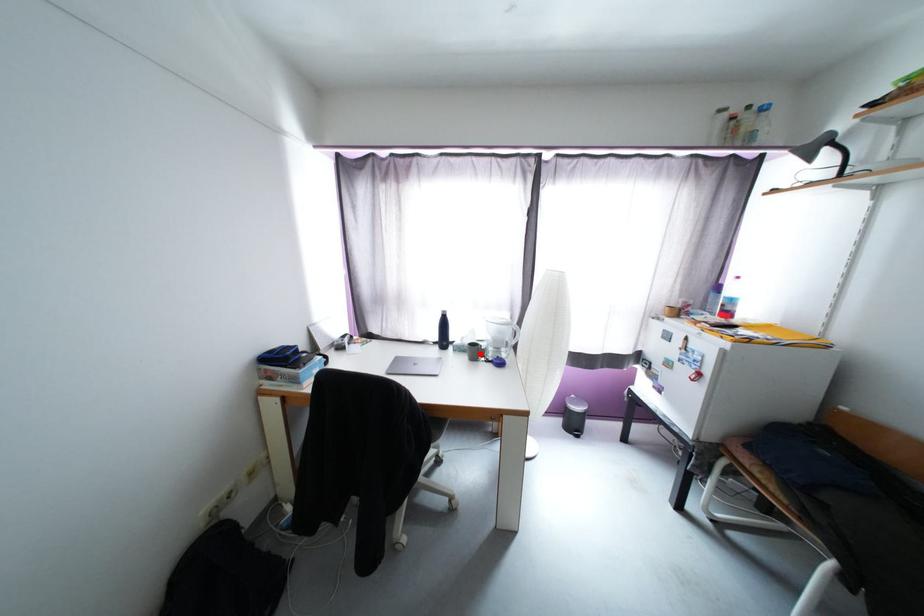
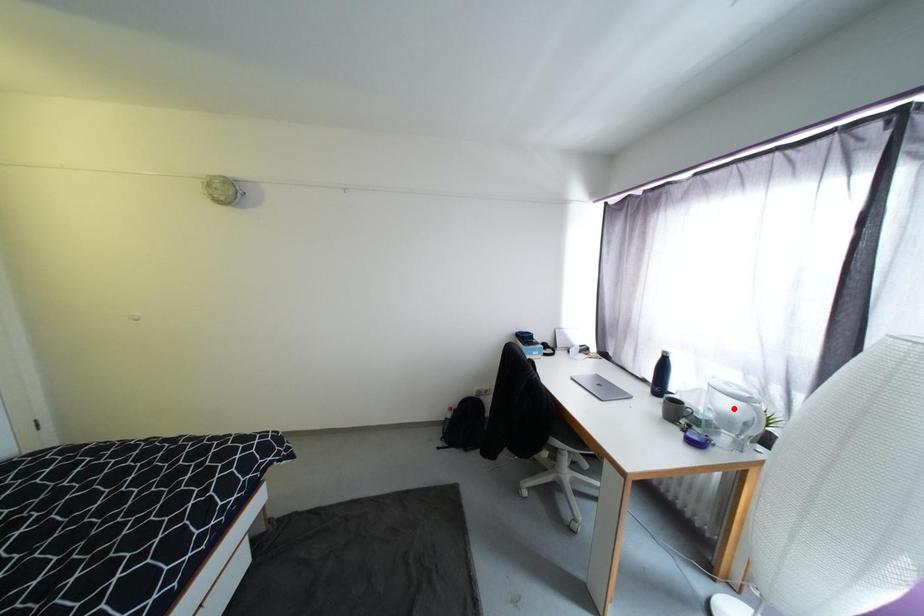
I am providing you with two images of the same scene from different viewpoints. A red point is marked on the first image and another point is marked on the second image. Is the red point in image1 aligned with the point shown in image2?

No